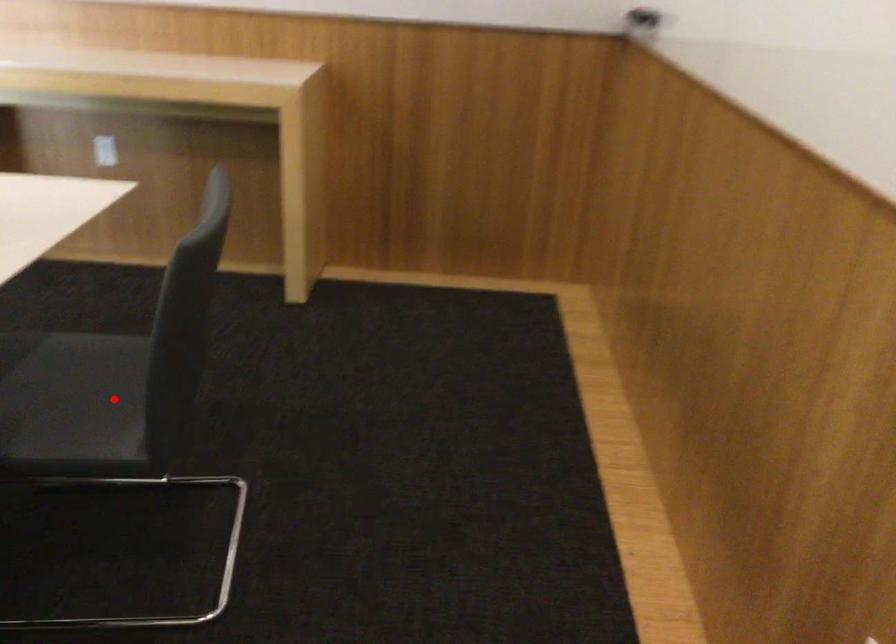
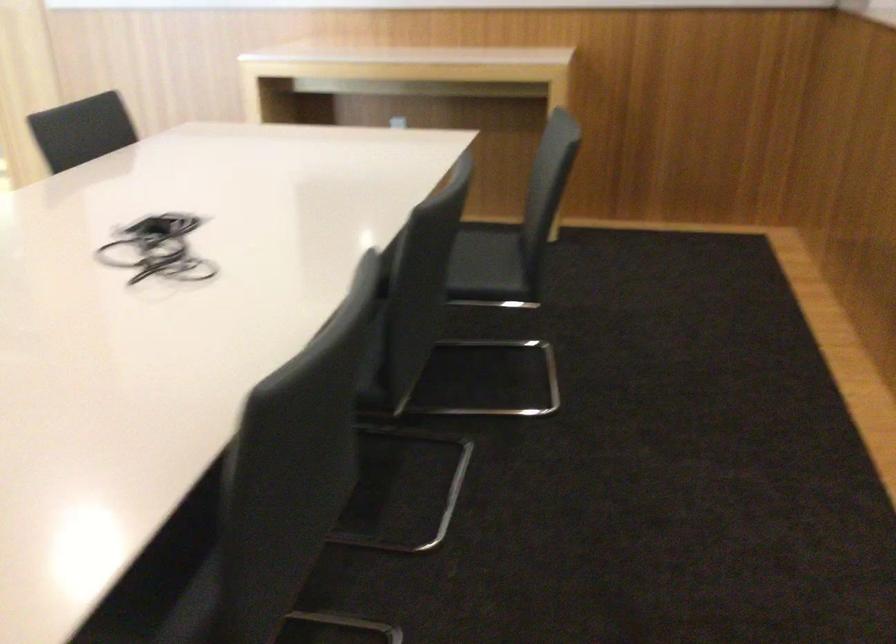
Question: I am providing you with two images of the same scene from different viewpoints. A red point is shown in image1. For the corresponding object point in image2, is it positioned nearer or farther from the camera?

Choices:
 (A) Nearer
 (B) Farther

Answer: (B)